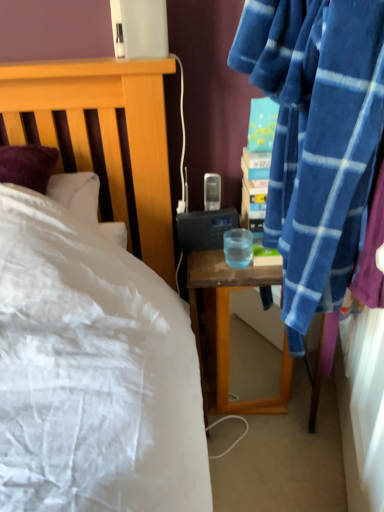
Question: Should I look upward or downward to see transparent plastic cup at bedside table?

Choices:
 (A) down
 (B) up

Answer: (B)

Question: Can we say transparent plastic cup at bedside table lies outside wooden desk at right?

Choices:
 (A) yes
 (B) no

Answer: (A)

Question: Is transparent plastic cup at bedside table positioned with its back to wooden desk at right?

Choices:
 (A) no
 (B) yes

Answer: (A)

Question: Is transparent plastic cup at bedside table with wooden desk at right?

Choices:
 (A) no
 (B) yes

Answer: (A)

Question: Can you confirm if transparent plastic cup at bedside table is bigger than wooden desk at right?

Choices:
 (A) yes
 (B) no

Answer: (B)

Question: Is transparent plastic cup at bedside table wider than wooden desk at right?

Choices:
 (A) no
 (B) yes

Answer: (A)

Question: Considering the relative sizes of transparent plastic cup at bedside table and wooden desk at right in the image provided, is transparent plastic cup at bedside table shorter than wooden desk at right?

Choices:
 (A) no
 (B) yes

Answer: (B)

Question: From a real-world perspective, is wooden desk at right located higher than transparent plastic cup at bedside table?

Choices:
 (A) yes
 (B) no

Answer: (B)

Question: Is transparent plastic cup at bedside table surrounded by wooden desk at right?

Choices:
 (A) yes
 (B) no

Answer: (B)

Question: Is wooden desk at right positioned in front of transparent plastic cup at bedside table?

Choices:
 (A) no
 (B) yes

Answer: (A)

Question: Does wooden desk at right appear on the right side of transparent plastic cup at bedside table?

Choices:
 (A) yes
 (B) no

Answer: (A)

Question: Does wooden desk at right come behind transparent plastic cup at bedside table?

Choices:
 (A) yes
 (B) no

Answer: (A)

Question: Is wooden desk at right not close to transparent plastic cup at bedside table?

Choices:
 (A) yes
 (B) no

Answer: (B)

Question: Is wooden desk at right bigger or smaller than transparent plastic cup at bedside table?

Choices:
 (A) small
 (B) big

Answer: (B)